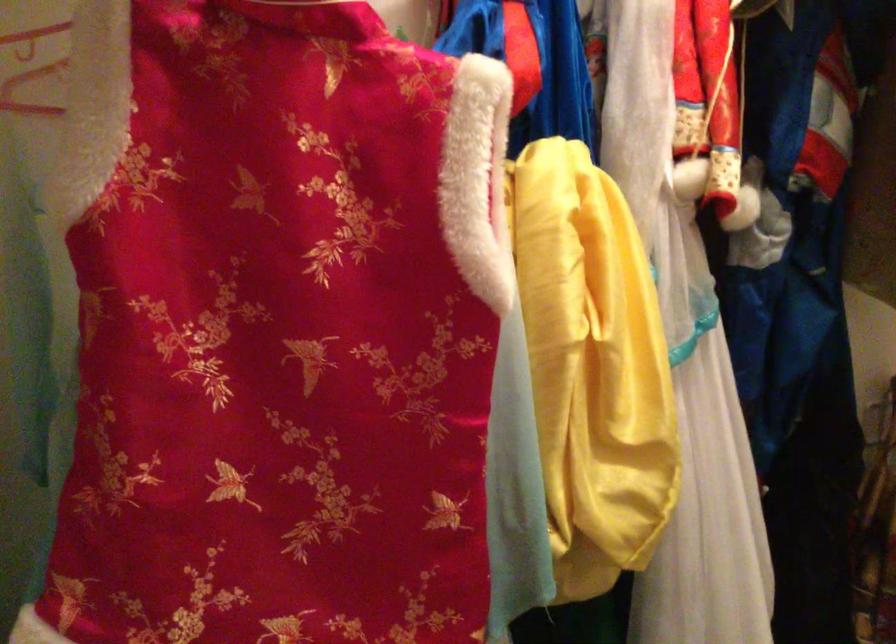
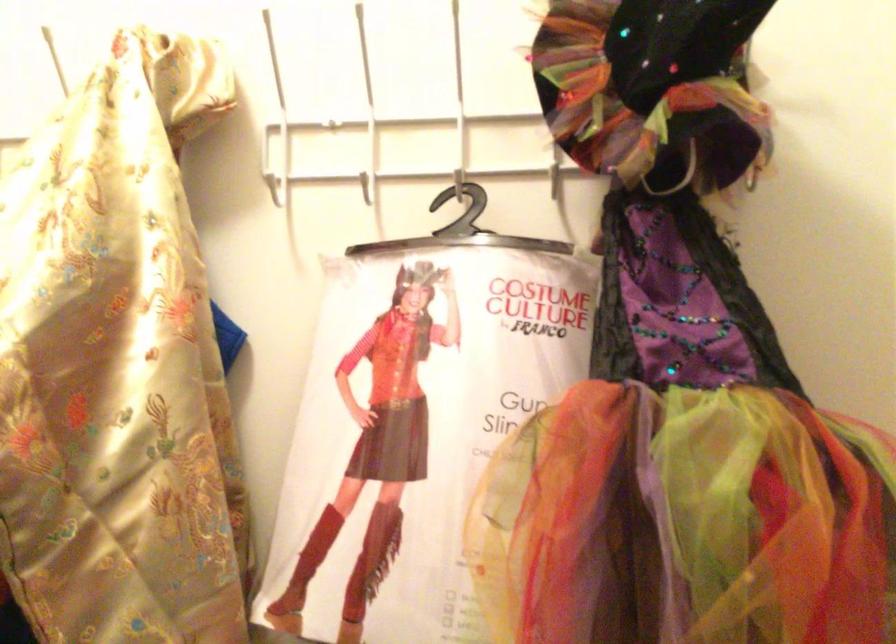
Question: What movement of the cameraman would produce the second image?

Choices:
 (A) Left
 (B) Right
 (C) Forward
 (D) Backward

Answer: (B)